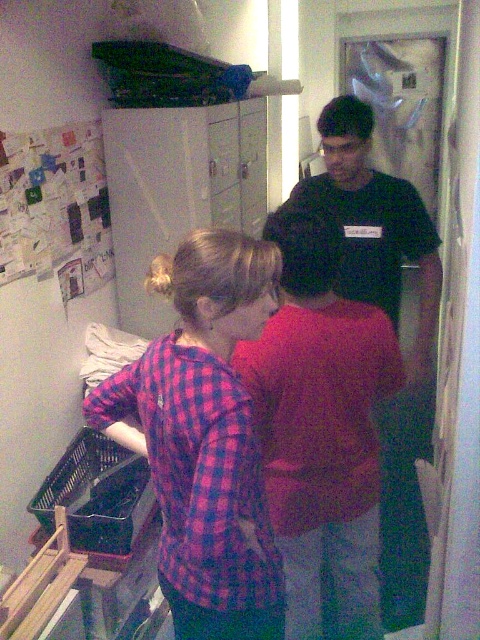
Question: Which point appears farthest from the camera in this image?

Choices:
 (A) (252, 500)
 (B) (362, 605)

Answer: (B)

Question: Can you confirm if plaid fabric shirt at center is wider than black matte shirt at center?

Choices:
 (A) yes
 (B) no

Answer: (B)

Question: Which point is closer to the camera?

Choices:
 (A) (335, 452)
 (B) (400, 417)

Answer: (A)

Question: Does plaid fabric shirt at center have a smaller size compared to matte red shirt at center?

Choices:
 (A) yes
 (B) no

Answer: (A)

Question: Does plaid fabric shirt at center have a lesser width compared to black matte shirt at center?

Choices:
 (A) no
 (B) yes

Answer: (B)

Question: Which point appears closest to the camera in this image?

Choices:
 (A) (352, 116)
 (B) (252, 324)

Answer: (B)